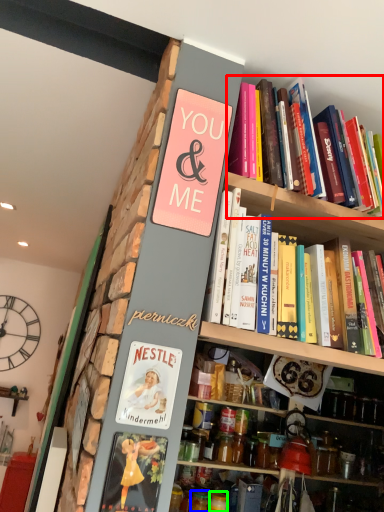
Question: Which is nearer to the book (highlighted by a red box)? glass jar (highlighted by a blue box) or glass jar (highlighted by a green box).

Choices:
 (A) glass jar
 (B) glass jar

Answer: (A)